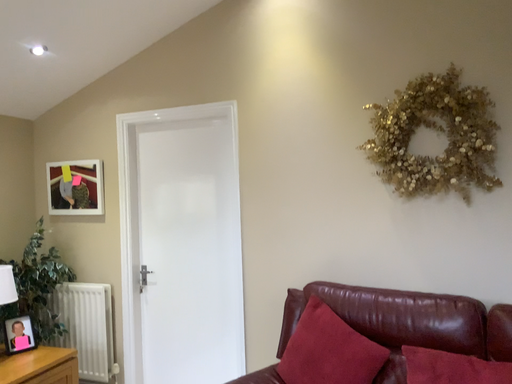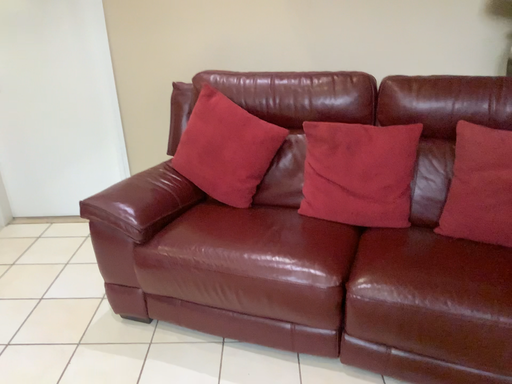
Question: Which way did the camera rotate in the video?

Choices:
 (A) rotated left
 (B) rotated right

Answer: (B)